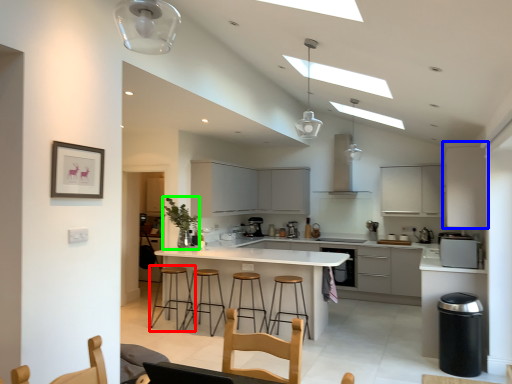
Question: Based on their relative distances, which object is nearer to bar stool (highlighted by a red box)? Choose from cabinetry (highlighted by a blue box) and plant (highlighted by a green box).

Choices:
 (A) cabinetry
 (B) plant

Answer: (B)